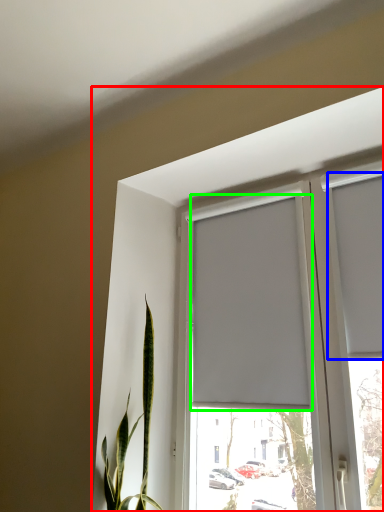
Question: Which object is positioned closest to window (highlighted by a red box)? Select from curtain (highlighted by a blue box) and curtain (highlighted by a green box).

Choices:
 (A) curtain
 (B) curtain

Answer: (B)